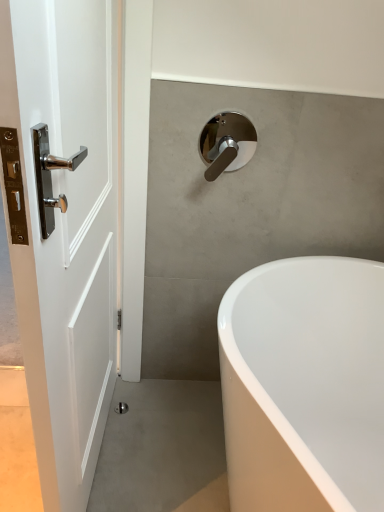
Question: Is white glossy bathtub at lower right inside the boundaries of white glossy door at left, or outside?

Choices:
 (A) inside
 (B) outside

Answer: (B)

Question: From the image's perspective, relative to white glossy door at left, is white glossy bathtub at lower right above or below?

Choices:
 (A) below
 (B) above

Answer: (A)

Question: Considering the real-world distances, which object is farthest from the chrome metallic tap at upper center?

Choices:
 (A) white glossy door at left
 (B) white glossy bathtub at lower right

Answer: (B)

Question: Considering the real-world distances, which object is farthest from the chrome metallic tap at upper center?

Choices:
 (A) white glossy door at left
 (B) white glossy bathtub at lower right

Answer: (B)